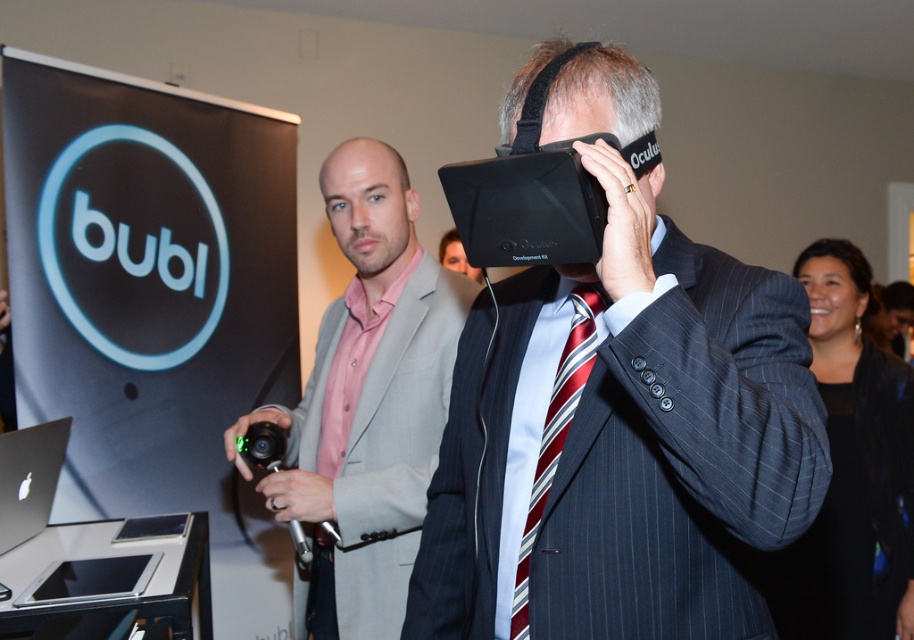
Between matte black vr headset at center and pink satin shirt at center, which one has more height?

pink satin shirt at center

Is matte black vr headset at center taller than pink satin shirt at center?

In fact, matte black vr headset at center may be shorter than pink satin shirt at center.

At what (x,y) coordinates should I click in order to perform the action: click on matte black vr headset at center. Please return your answer as a coordinate pair (x, y). Looking at the image, I should click on (622, 442).

Is matte black vr headset at center in front of black matte laptop at lower left?

Yes, matte black vr headset at center is closer to the viewer.

The height and width of the screenshot is (640, 914). Identify the location of matte black vr headset at center. (622, 442).

Who is more forward, (668,563) or (9,438)?

Positioned in front is point (668,563).

In order to click on matte black vr headset at center in this screenshot , I will do `click(622, 442)`.

Based on the photo, how much distance is there between pink satin shirt at center and striped silk tie at center?

30.74 inches

Who is taller, pink satin shirt at center or striped silk tie at center?

With more height is pink satin shirt at center.

Who is more forward, (392,179) or (546,428)?

Point (546,428)

In order to click on pink satin shirt at center in this screenshot , I will do `click(367, 403)`.